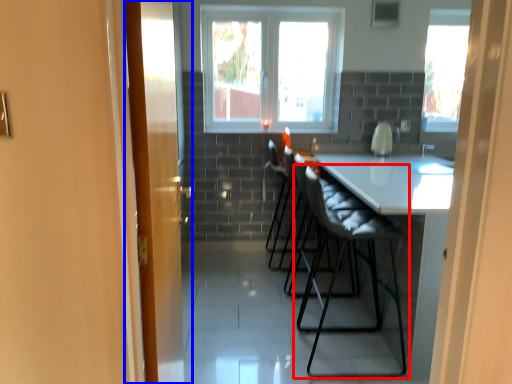
Question: Which object is closer to the camera taking this photo, chair (highlighted by a red box) or door (highlighted by a blue box)?

Choices:
 (A) chair
 (B) door

Answer: (B)